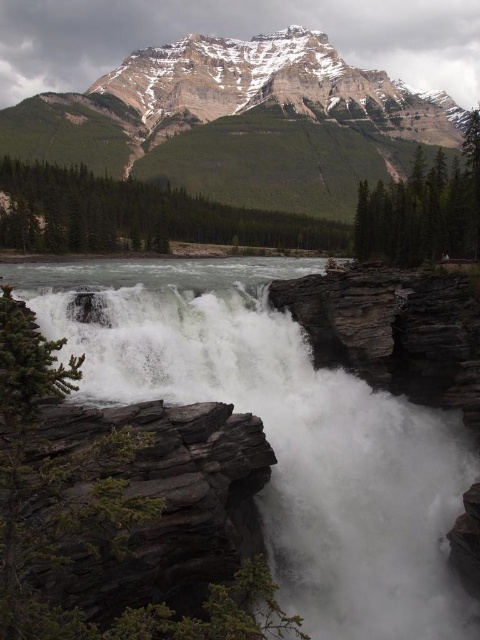
Question: Is white frothy water at center wider than dark gray rock at lower left?

Choices:
 (A) no
 (B) yes

Answer: (B)

Question: Which of the following is the farthest from the observer?

Choices:
 (A) 305,509
 (B) 220,134

Answer: (B)

Question: Which object is farther from the camera taking this photo?

Choices:
 (A) snowy rocky mountain at upper center
 (B) white frothy water at center
 (C) dark gray rock at lower left

Answer: (A)

Question: Is snowy rocky mountain at upper center closer to the viewer compared to dark gray rock at lower left?

Choices:
 (A) no
 (B) yes

Answer: (A)

Question: Estimate the real-world distances between objects in this image. Which object is farther from the white frothy water at center?

Choices:
 (A) snowy rocky mountain at upper center
 (B) dark gray rock at lower left

Answer: (A)

Question: Does snowy rocky mountain at upper center appear under dark gray rock at lower left?

Choices:
 (A) yes
 (B) no

Answer: (B)